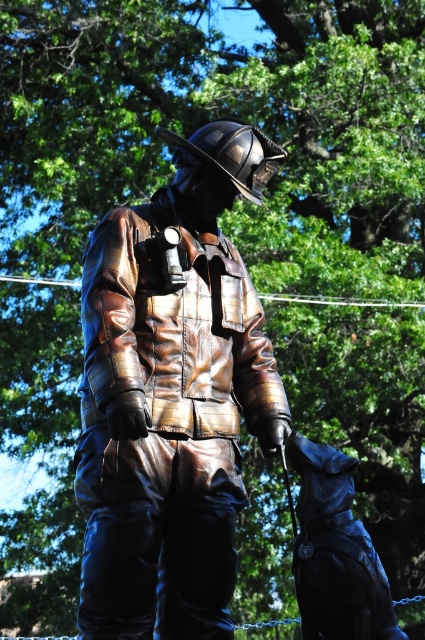
Who is lower down, shiny bronze firefighter at center or shiny black dog at lower right?

shiny black dog at lower right is lower down.

Can you confirm if shiny bronze firefighter at center is positioned to the right of shiny black dog at lower right?

No, shiny bronze firefighter at center is not to the right of shiny black dog at lower right.

Which is in front, point (167, 451) or point (316, 538)?

Point (316, 538) is in front.

Image resolution: width=425 pixels, height=640 pixels. I want to click on shiny bronze firefighter at center, so click(x=172, y=396).